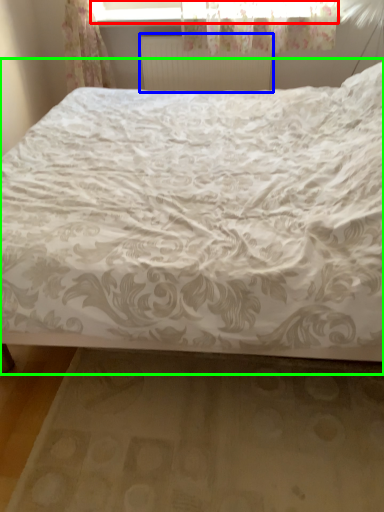
Question: Which object is the closest to the window frame (highlighted by a red box)? Choose among these: radiator (highlighted by a blue box) or bed (highlighted by a green box).

Choices:
 (A) radiator
 (B) bed

Answer: (A)